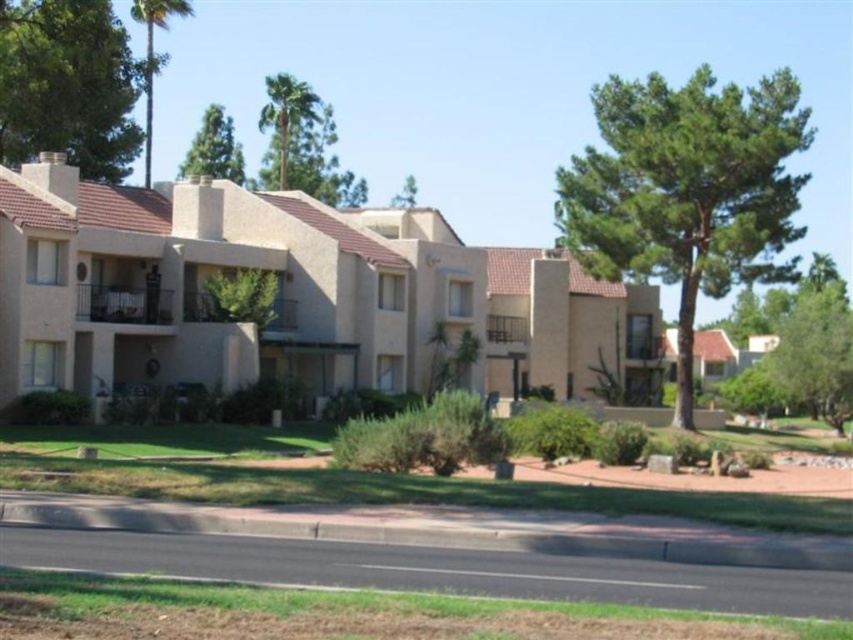
You are standing on the paved road in front of the beige apartment buildings. You want to take a photo of the green leafy palm at upper center. Where should you position yourself relative to the buildings to ensure the palm is in the center of your photo?

To center the green leafy palm at upper center in your photo, position yourself directly in front of the point where the palm is located, which is at coordinates approximately 0.181 on the horizontal axis and 0.338 on the vertical axis relative to the image frame.

You are a landscape architect planning to plant a new tree in this residential area. You have two options from the image, the green leafy tree at upper left and the green leafy palm at upper center. Which tree would you choose if you want a taller tree for shade?

The green leafy palm at upper center is taller than the green leafy tree at upper left, so you should choose the green leafy palm at upper center for a taller tree that provides more shade.